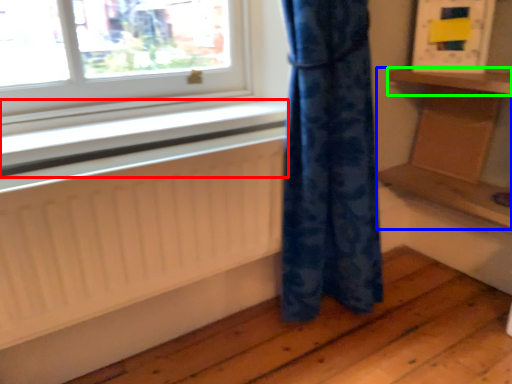
Question: Considering the real-world distances, which object is closest to window sill (highlighted by a red box)? furniture (highlighted by a blue box) or shelf (highlighted by a green box).

Choices:
 (A) furniture
 (B) shelf

Answer: (A)